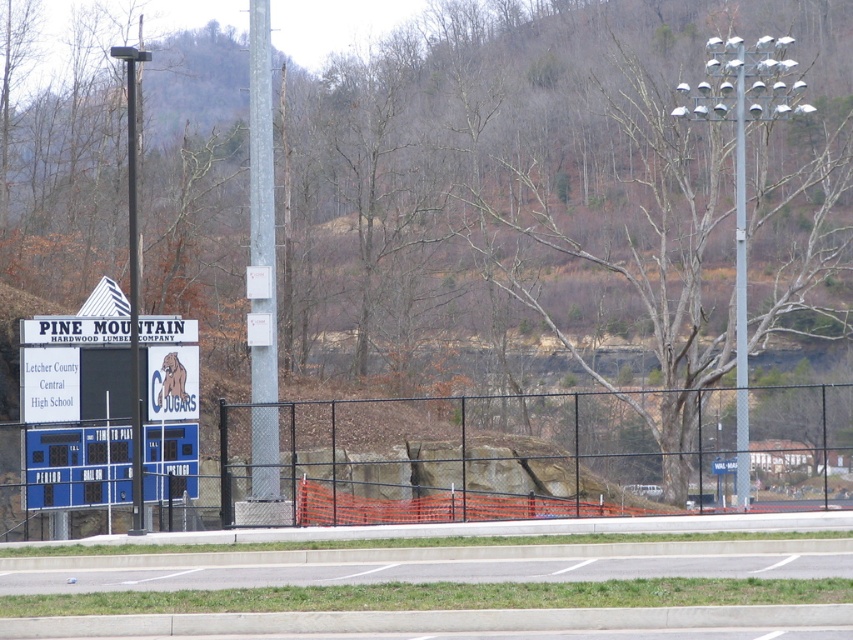
Does metallic gray pole at upper right appear under metallic pole at left?

No, metallic gray pole at upper right is not below metallic pole at left.

Between metallic gray pole at upper right and metallic pole at left, which one is positioned higher?

Positioned higher is metallic gray pole at upper right.

Locate an element on the screen. The width and height of the screenshot is (853, 640). metallic gray pole at upper right is located at coordinates (740, 291).

Locate an element on the screen. metallic gray pole at upper right is located at coordinates (740, 291).

Is metallic gray pole at center bigger than metallic gray pole at upper right?

No.

Between metallic gray pole at center and metallic gray pole at upper right, which one is positioned higher?

metallic gray pole at upper right

This screenshot has width=853, height=640. What do you see at coordinates (262, 260) in the screenshot?
I see `metallic gray pole at center` at bounding box center [262, 260].

You are a GUI agent. You are given a task and a screenshot of the screen. Output one action in this format:
    pyautogui.click(x=<x>, y=<y>)
    Task: Click on the metallic gray pole at center
    The height and width of the screenshot is (640, 853).
    Given the screenshot: What is the action you would take?
    pyautogui.click(x=262, y=260)

Who is lower down, blue glossy scoreboard at left or metallic gray pole at upper right?

blue glossy scoreboard at left

Does blue glossy scoreboard at left have a greater width compared to metallic gray pole at upper right?

No.

Is point (48, 492) behind point (738, 144)?

No, (48, 492) is closer to viewer.

Find the location of a particular element. This screenshot has width=853, height=640. blue glossy scoreboard at left is located at coordinates tap(76, 467).